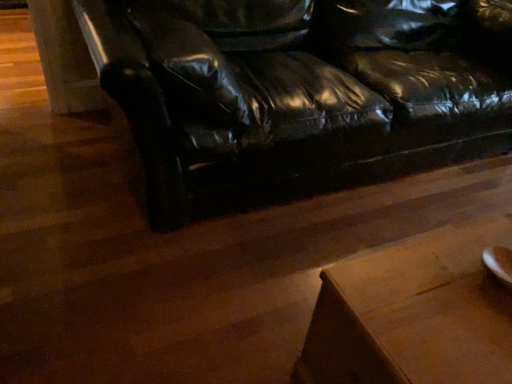
Question: Considering their positions, is black leather couch at center located in front of or behind wooden table at lower right?

Choices:
 (A) behind
 (B) front

Answer: (A)

Question: From their relative heights in the image, would you say black leather couch at center is taller or shorter than wooden table at lower right?

Choices:
 (A) short
 (B) tall

Answer: (B)

Question: Based on their sizes in the image, would you say black leather couch at center is bigger or smaller than wooden table at lower right?

Choices:
 (A) small
 (B) big

Answer: (B)

Question: Is wooden table at lower right to the left or to the right of black leather couch at center in the image?

Choices:
 (A) right
 (B) left

Answer: (A)

Question: Is wooden table at lower right situated inside black leather couch at center or outside?

Choices:
 (A) inside
 (B) outside

Answer: (B)

Question: From the image's perspective, is wooden table at lower right positioned above or below black leather couch at center?

Choices:
 (A) above
 (B) below

Answer: (B)

Question: Looking at the image, does wooden table at lower right seem bigger or smaller compared to black leather couch at center?

Choices:
 (A) small
 (B) big

Answer: (A)